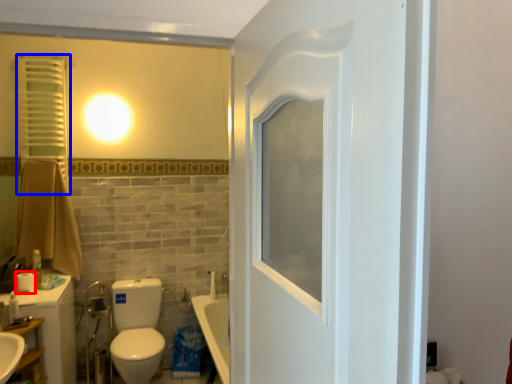
Question: Among these objects, which one is farthest to the camera, toilet paper (highlighted by a red box) or shutter (highlighted by a blue box)?

Choices:
 (A) toilet paper
 (B) shutter

Answer: (B)